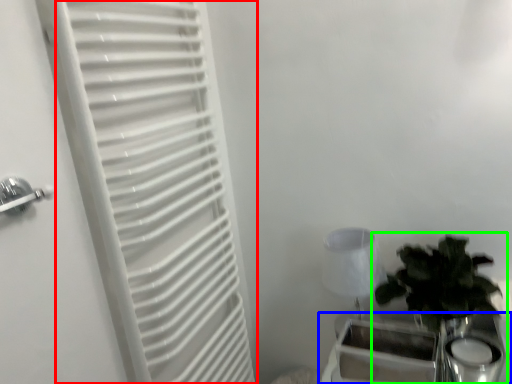
Question: Considering the real-world distances, which object is closest to curtain (highlighted by a red box)? table (highlighted by a blue box) or houseplant (highlighted by a green box).

Choices:
 (A) table
 (B) houseplant

Answer: (A)